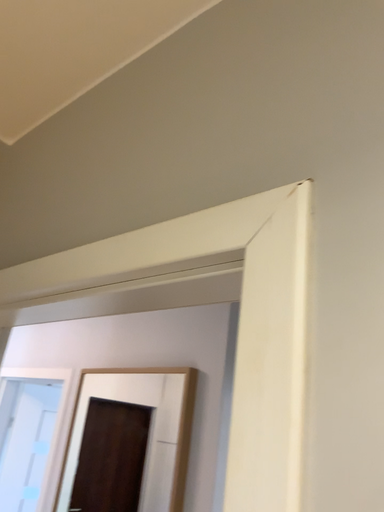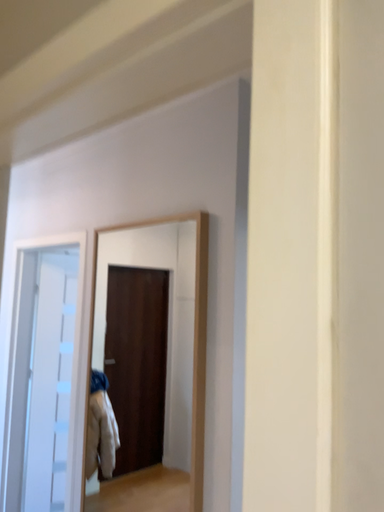
Question: Which way did the camera rotate in the video?

Choices:
 (A) rotated downward
 (B) rotated upward

Answer: (A)